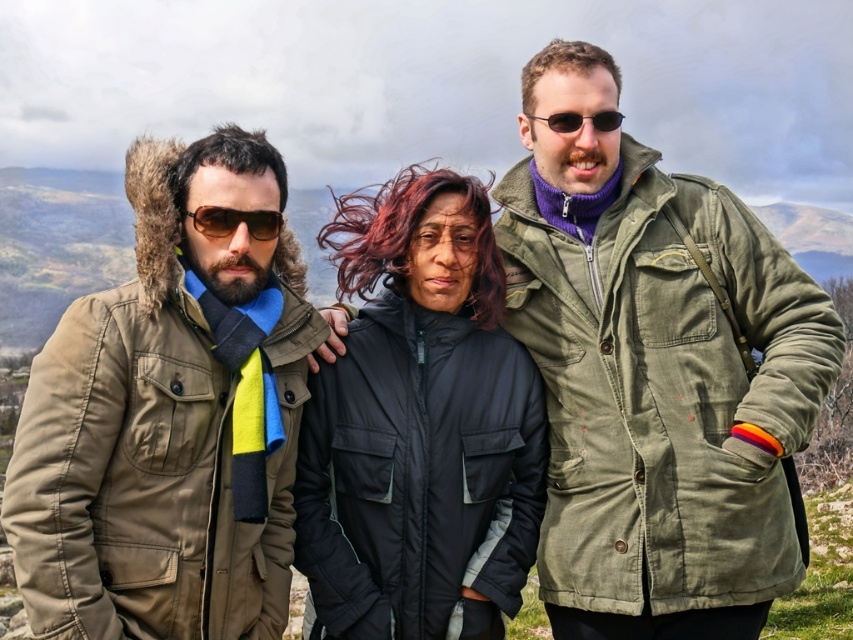
Does olive-green canvas jacket at center-right have a lesser height compared to matte brown sunglasses at center?

Incorrect, olive-green canvas jacket at center-right's height does not fall short of matte brown sunglasses at center's.

This screenshot has width=853, height=640. Describe the element at coordinates (654, 374) in the screenshot. I see `olive-green canvas jacket at center-right` at that location.

What do you see at coordinates (654, 374) in the screenshot? The image size is (853, 640). I see `olive-green canvas jacket at center-right` at bounding box center [654, 374].

Identify the location of olive-green canvas jacket at center-right. The width and height of the screenshot is (853, 640). (654, 374).

Between khaki fabric jacket at left and matte brown sunglasses at center, which one is positioned lower?

khaki fabric jacket at left is lower down.

Who is more forward, [33,502] or [221,227]?

Point [33,502]

Where is `khaki fabric jacket at left`? The image size is (853, 640). khaki fabric jacket at left is located at coordinates (x=169, y=417).

Is the position of olive-green canvas jacket at center-right less distant than that of khaki fabric jacket at left?

No, olive-green canvas jacket at center-right is behind khaki fabric jacket at left.

Is the position of olive-green canvas jacket at center-right more distant than that of khaki fabric jacket at left?

Yes, it is.

Where is `olive-green canvas jacket at center-right`? olive-green canvas jacket at center-right is located at coordinates (654, 374).